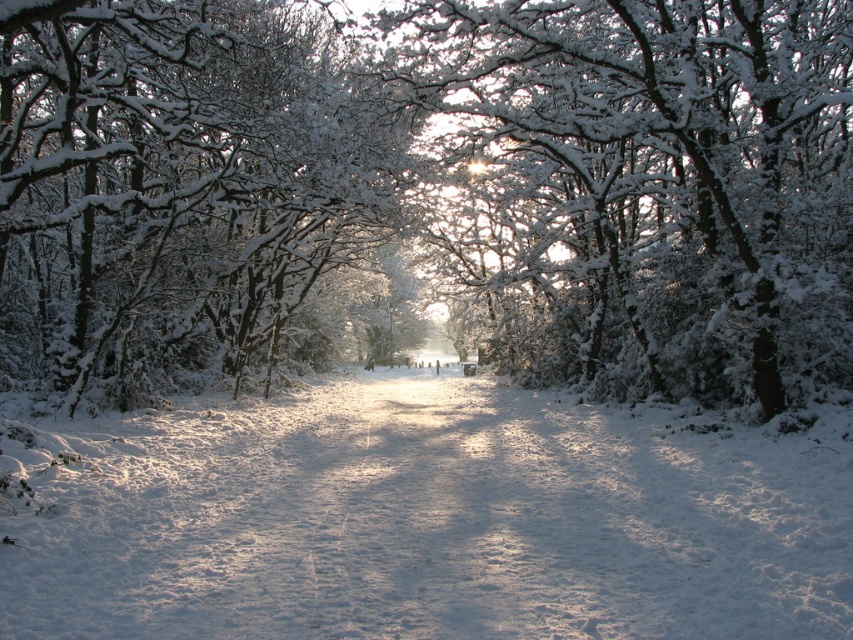
Where is `white snow at center`? The image size is (853, 640). white snow at center is located at coordinates (426, 518).

Can you confirm if white snow at center is positioned below white frosty branches at center?

Indeed, white snow at center is positioned under white frosty branches at center.

Is point (450, 426) less distant than point (119, 52)?

No, it is behind (119, 52).

Where is `white snow at center`? The image size is (853, 640). white snow at center is located at coordinates (426, 518).

Can you confirm if white snow-covered tree at center is positioned to the left of white frosty branches at center?

No, white snow-covered tree at center is not to the left of white frosty branches at center.

What do you see at coordinates (662, 177) in the screenshot?
I see `white snow-covered tree at center` at bounding box center [662, 177].

Who is more forward, (x=850, y=342) or (x=177, y=83)?

Point (x=850, y=342) is in front.

Where is `white snow-covered tree at center`? white snow-covered tree at center is located at coordinates (662, 177).

Which is more to the right, white snow at center or white snow-covered tree at center?

white snow-covered tree at center is more to the right.

Is point (709, 536) more distant than point (640, 284)?

No, (709, 536) is in front of (640, 284).

This screenshot has width=853, height=640. Identify the location of white snow at center. (426, 518).